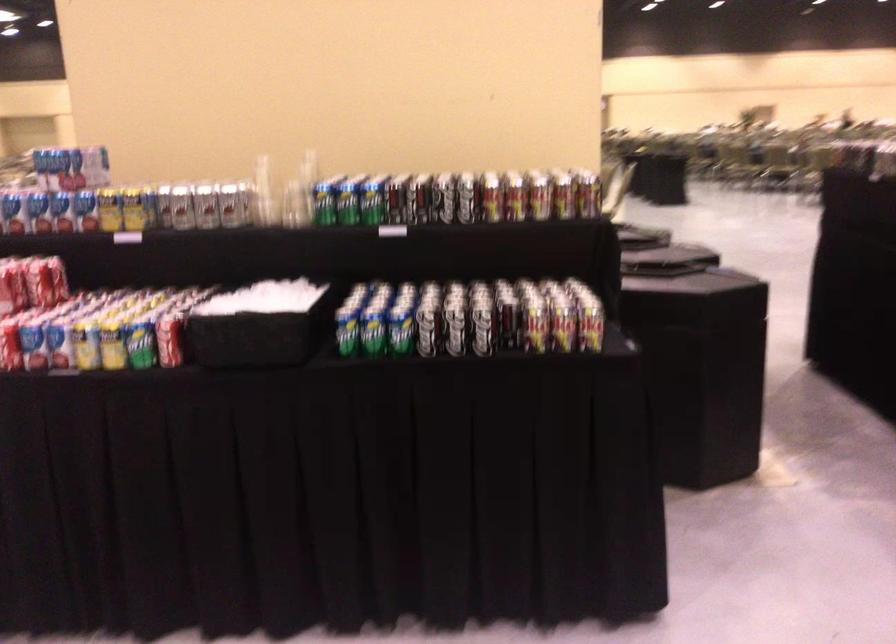
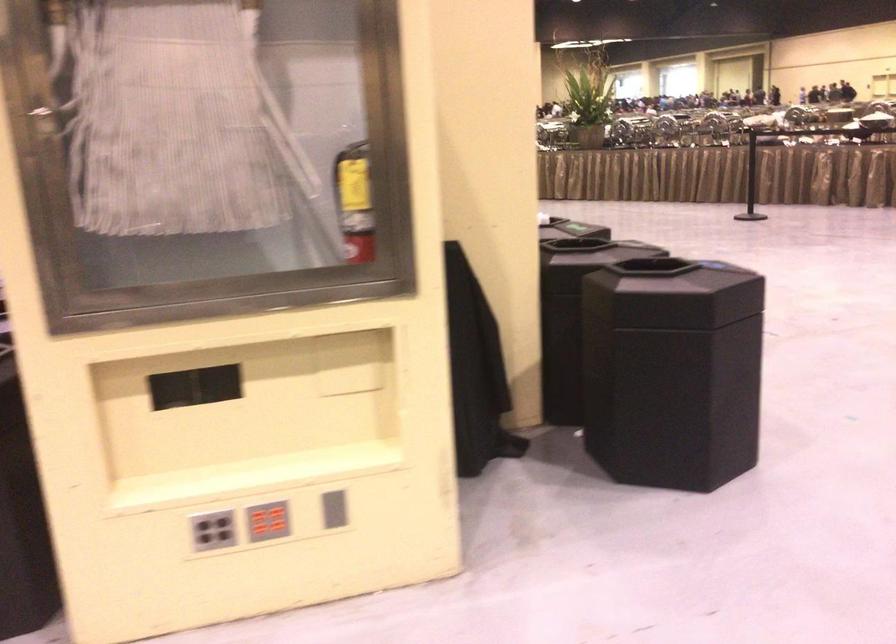
Question: I am providing you with two images of the same scene from different viewpoints. After the viewpoint changes to image2, which objects are now occluded?

Choices:
 (A) grey button panel
 (B) small metal bowl
 (C) blue soda can
 (D) red button panel

Answer: (C)